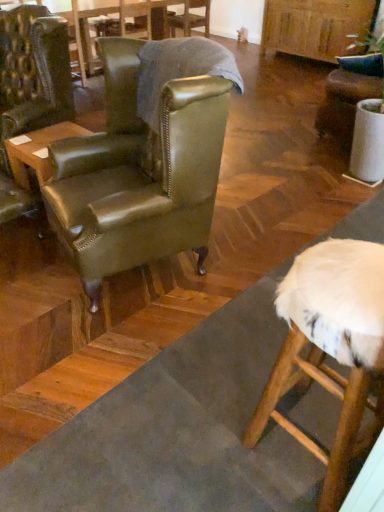
Question: From the image's perspective, is leather wingback chair at center, the 1th chair viewed from the right, located above leather green wingback chair at left, acting as the 2th chair starting from the front?

Choices:
 (A) yes
 (B) no

Answer: (A)

Question: Considering the relative sizes of leather wingback chair at center, the 1th chair viewed from the right, and leather green wingback chair at left, which appears as the 1th chair when viewed from the left, in the image provided, is leather wingback chair at center, the 1th chair viewed from the right, wider than leather green wingback chair at left, which appears as the 1th chair when viewed from the left,?

Choices:
 (A) no
 (B) yes

Answer: (A)

Question: Are leather wingback chair at center, the 1th chair viewed from the right, and leather green wingback chair at left, the 3th chair when ordered from back to front, making contact?

Choices:
 (A) yes
 (B) no

Answer: (B)

Question: Can you confirm if leather wingback chair at center, which is the 2th chair in back-to-front order, is smaller than leather green wingback chair at left, the fourth chair when ordered from right to left?

Choices:
 (A) yes
 (B) no

Answer: (A)

Question: Is leather wingback chair at center, which is the fourth chair from left to right, closer to camera compared to leather green wingback chair at left, the fourth chair when ordered from right to left?

Choices:
 (A) yes
 (B) no

Answer: (B)

Question: Can you confirm if leather wingback chair at center, marked as the 3th chair in a front-to-back arrangement, is thinner than leather green wingback chair at left, acting as the 2th chair starting from the front?

Choices:
 (A) no
 (B) yes

Answer: (B)

Question: From a real-world perspective, is leather wingback chair at center, which is the 2th chair in back-to-front order, on top of wooden table at left, which is the first table from front to back?

Choices:
 (A) yes
 (B) no

Answer: (A)

Question: Does leather wingback chair at center, which is the fourth chair from left to right, have a larger size compared to wooden table at left, acting as the 2th table starting from the back?

Choices:
 (A) no
 (B) yes

Answer: (B)

Question: Considering the relative sizes of leather wingback chair at center, which is the fourth chair from left to right, and wooden table at left, which is the first table from front to back, in the image provided, is leather wingback chair at center, which is the fourth chair from left to right, wider than wooden table at left, which is the first table from front to back,?

Choices:
 (A) no
 (B) yes

Answer: (B)

Question: Can you confirm if leather wingback chair at center, marked as the 3th chair in a front-to-back arrangement, is shorter than wooden table at left, which is the first table from front to back?

Choices:
 (A) yes
 (B) no

Answer: (B)

Question: Is leather wingback chair at center, the 1th chair viewed from the right, touching wooden table at left, marked as the first table in a bottom-to-top arrangement?

Choices:
 (A) yes
 (B) no

Answer: (B)

Question: Is leather wingback chair at center, which is the 2th chair in back-to-front order, outside of wooden table at left, acting as the 2th table starting from the back?

Choices:
 (A) no
 (B) yes

Answer: (B)

Question: From a real-world perspective, is leather wingback chair at center, the 1th chair viewed from the right, on top of green leather table at upper left, the 2th table when ordered from bottom to top?

Choices:
 (A) no
 (B) yes

Answer: (B)